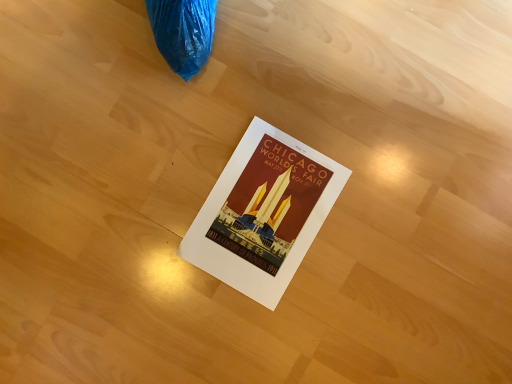
The width and height of the screenshot is (512, 384). I want to click on matte paper poster at center, so click(263, 213).

What do you see at coordinates (263, 213) in the screenshot? I see `matte paper poster at center` at bounding box center [263, 213].

Where is `matte paper poster at center`? matte paper poster at center is located at coordinates (263, 213).